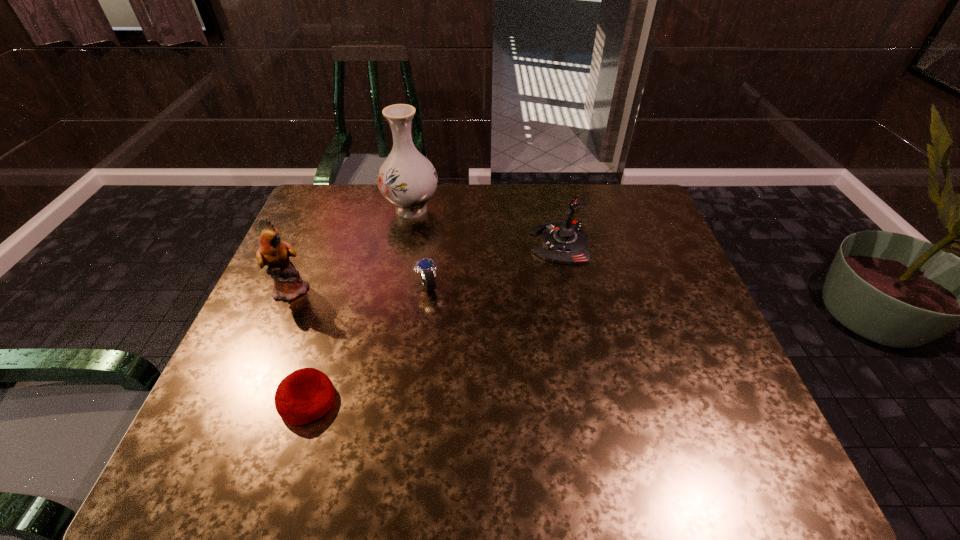
The height and width of the screenshot is (540, 960). What are the coordinates of `free space at the left edge of the desktop` in the screenshot? It's located at (249, 434).

Where is `vacant space at the right edge`? The image size is (960, 540). vacant space at the right edge is located at coordinates (657, 364).

In the image, there is a desktop. Where is `vacant space at the far left corner`? vacant space at the far left corner is located at coordinates (332, 210).

Find the location of `vacant space at the near left corner`. vacant space at the near left corner is located at coordinates (267, 442).

In the image, there is a desktop. Where is `vacant space at the far right corner`? The image size is (960, 540). vacant space at the far right corner is located at coordinates (627, 200).

Find the location of a particular element. This screenshot has width=960, height=540. free point between the third tallest object and the vase is located at coordinates (486, 226).

Where is `vacant area between the watch and the joystick`? The image size is (960, 540). vacant area between the watch and the joystick is located at coordinates (493, 264).

Where is `empty location between the nearest object and the watch`? empty location between the nearest object and the watch is located at coordinates (368, 343).

The width and height of the screenshot is (960, 540). I want to click on vacant area that lies between the nearest object and the leftmost object, so click(x=300, y=345).

Identify the location of free space that is in between the nearest object and the watch. The width and height of the screenshot is (960, 540). (368, 343).